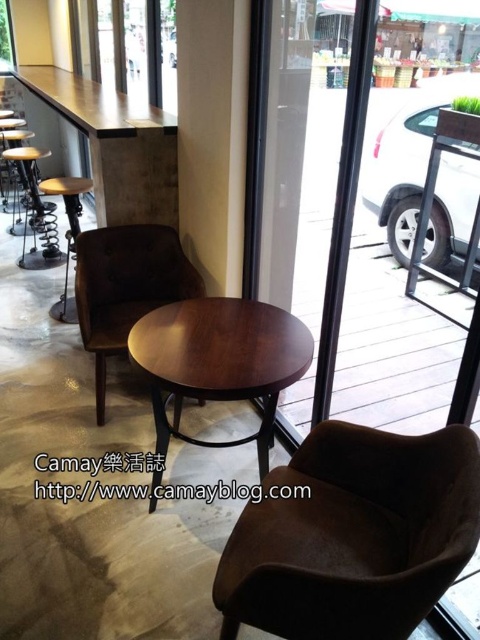
You are a delivery person trying to bring a large package through the transparent glass door at center. The package is as wide as the brown leather armchair at center. Will the package fit through the door?

The transparent glass door at center is wider than the brown leather armchair at center, so the package, which is as wide as the brown leather armchair at center, should fit through the door.

Looking at this image, you are standing at the entrance of the establishment and want to sit down. There is a brown leather armchair at center located at point (126, 285). Can you walk directly to that chair without needing to move any furniture?

Yes, because the brown leather armchair at center is positioned at point (126, 285), which is accessible from the entrance without requiring any furniture rearrangement.